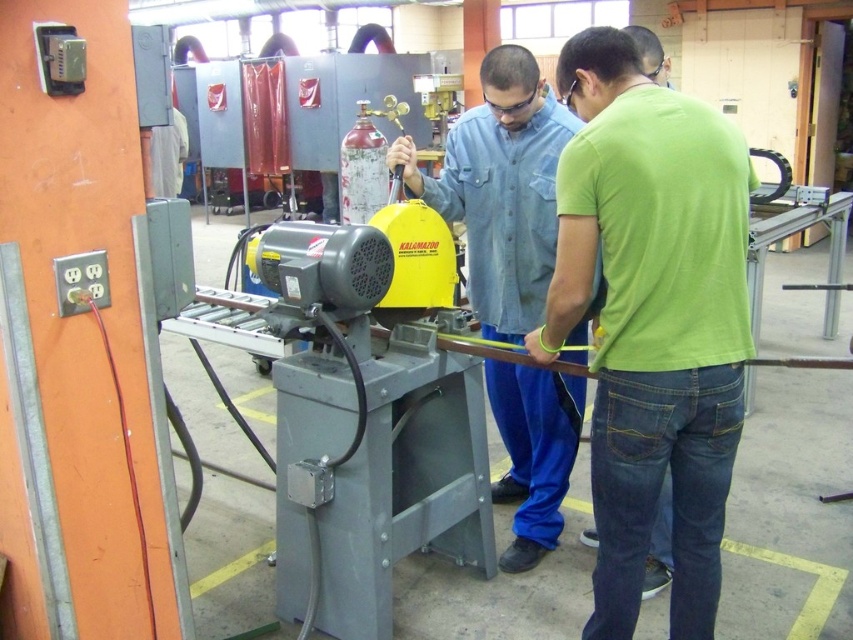
From the picture: Which is more to the left, green cotton shirt at center or denim shirt at center?

denim shirt at center

What do you see at coordinates (653, 320) in the screenshot?
I see `green cotton shirt at center` at bounding box center [653, 320].

In order to click on green cotton shirt at center in this screenshot , I will do `click(653, 320)`.